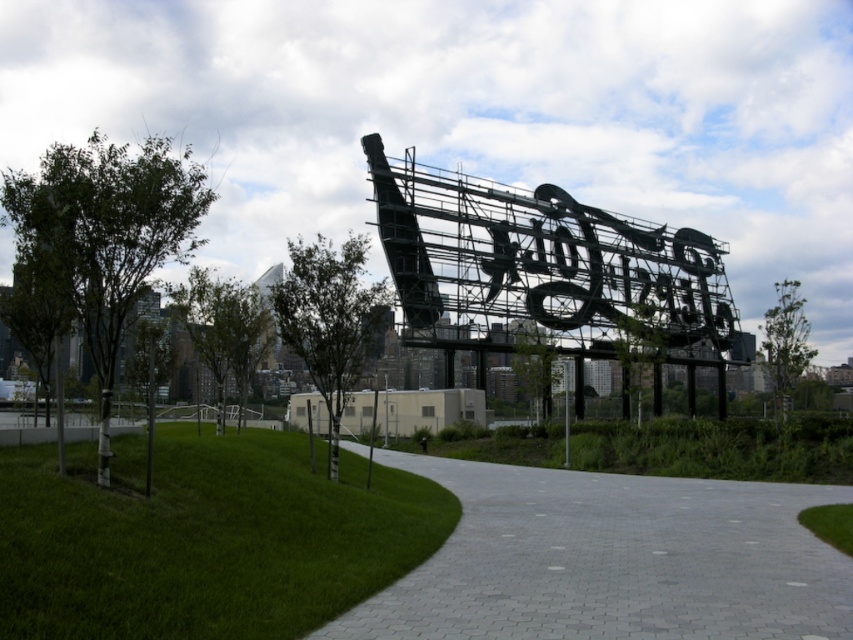
Question: Is green grass at lower left above green grass at lower center?

Choices:
 (A) no
 (B) yes

Answer: (B)

Question: Among these points, which one is nearest to the camera?

Choices:
 (A) (352, 554)
 (B) (463, 538)
 (C) (796, 428)

Answer: (A)

Question: Which point is closer to the camera?

Choices:
 (A) (281, 534)
 (B) (756, 429)
 (C) (538, 588)

Answer: (C)

Question: Among these objects, which one is farthest from the camera?

Choices:
 (A) green grass at lower left
 (B) gray paver path at center

Answer: (B)

Question: Where is green grass at lower left located in relation to green grass at lower center in the image?

Choices:
 (A) right
 (B) left

Answer: (B)

Question: Where is green grass at lower left located in relation to gray paver path at center in the image?

Choices:
 (A) left
 (B) right

Answer: (A)